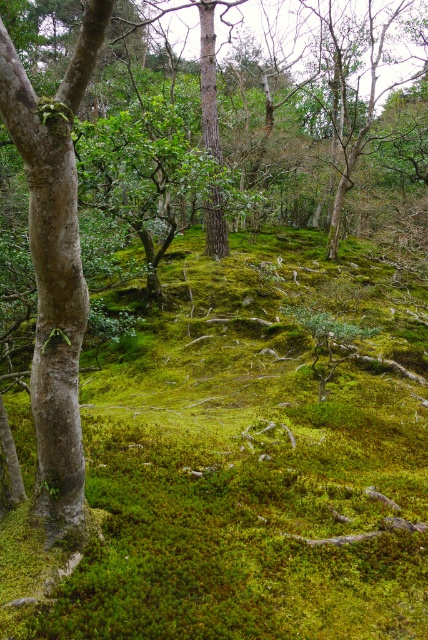
Question: Does green mossy ground at center lie in front of smooth brown tree trunk at center?

Choices:
 (A) no
 (B) yes

Answer: (B)

Question: Is green mossy ground at center positioned in front of smooth brown tree trunk at center?

Choices:
 (A) yes
 (B) no

Answer: (A)

Question: Which of the following is the farthest from the observer?

Choices:
 (A) smooth brown tree trunk at center
 (B) green mossy ground at center

Answer: (A)

Question: Which object appears closest to the camera in this image?

Choices:
 (A) smooth brown tree trunk at center
 (B) green mossy ground at center

Answer: (B)

Question: Is green mossy ground at center to the left of smooth brown tree trunk at center from the viewer's perspective?

Choices:
 (A) no
 (B) yes

Answer: (A)